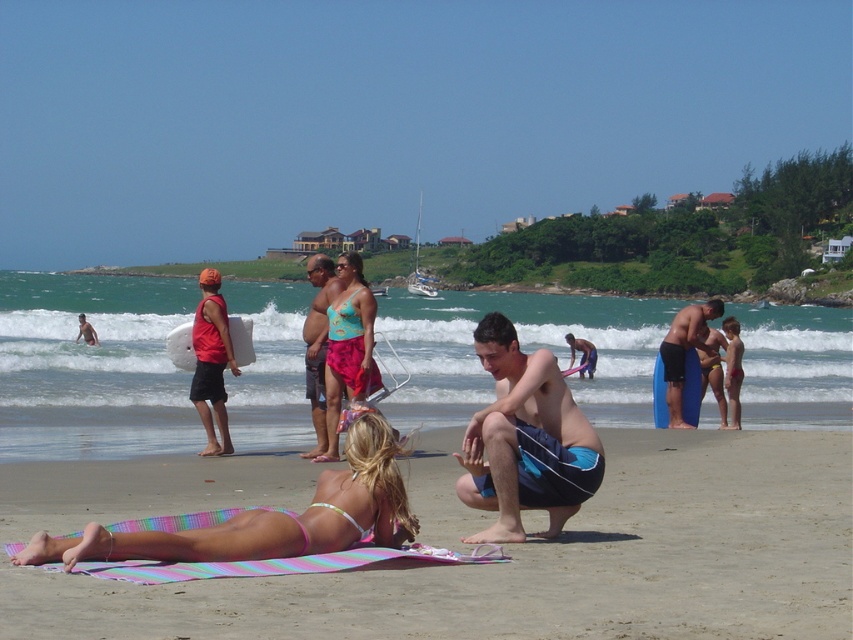
Does pink striped towel at lower center appear on the left side of matte black surfboard at center?

Indeed, pink striped towel at lower center is positioned on the left side of matte black surfboard at center.

Between pink striped towel at lower center and matte black surfboard at center, which one appears on the right side from the viewer's perspective?

matte black surfboard at center is more to the right.

Which is behind, point (721, 573) or point (698, 307)?

Positioned behind is point (698, 307).

Locate an element on the screen. Image resolution: width=853 pixels, height=640 pixels. pink striped towel at lower center is located at coordinates (480, 566).

Is point (311, 323) behind point (592, 374)?

No.

Can you confirm if matte teal bikini top at center is positioned to the right of matte blue surfboard at center?

No, matte teal bikini top at center is not to the right of matte blue surfboard at center.

Measure the distance between point (321, 339) and camera.

Point (321, 339) and camera are 54.56 feet apart.

Where is `matte teal bikini top at center`? matte teal bikini top at center is located at coordinates (318, 344).

Can you confirm if pink fabric bikini at lower left is smaller than matte black surfboard at center?

Yes, pink fabric bikini at lower left is smaller than matte black surfboard at center.

Is pink fabric bikini at lower left bigger than matte black surfboard at center?

No.

Is point (305, 528) closer to viewer compared to point (664, 349)?

Yes, it is in front of point (664, 349).

Identify the location of pink fabric bikini at lower left. (270, 516).